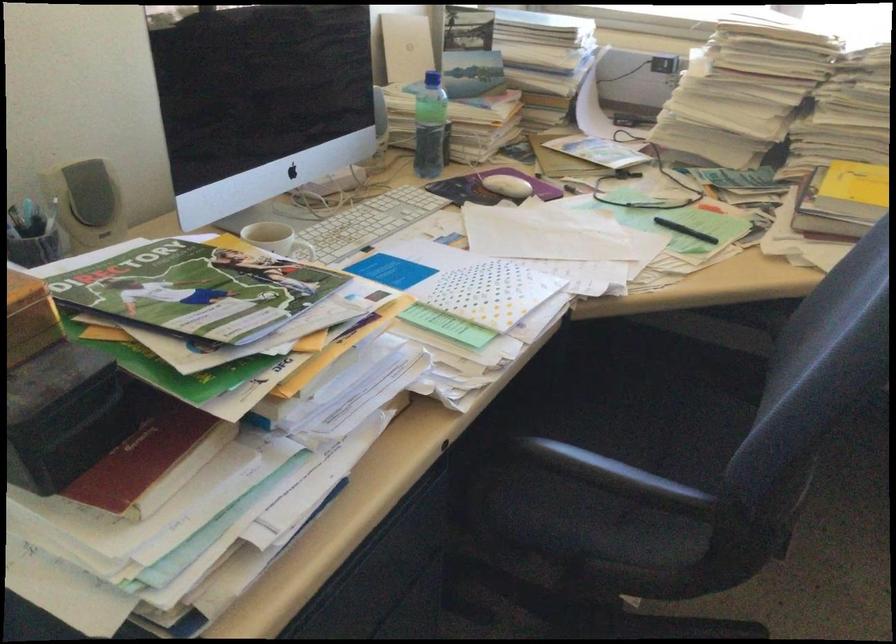
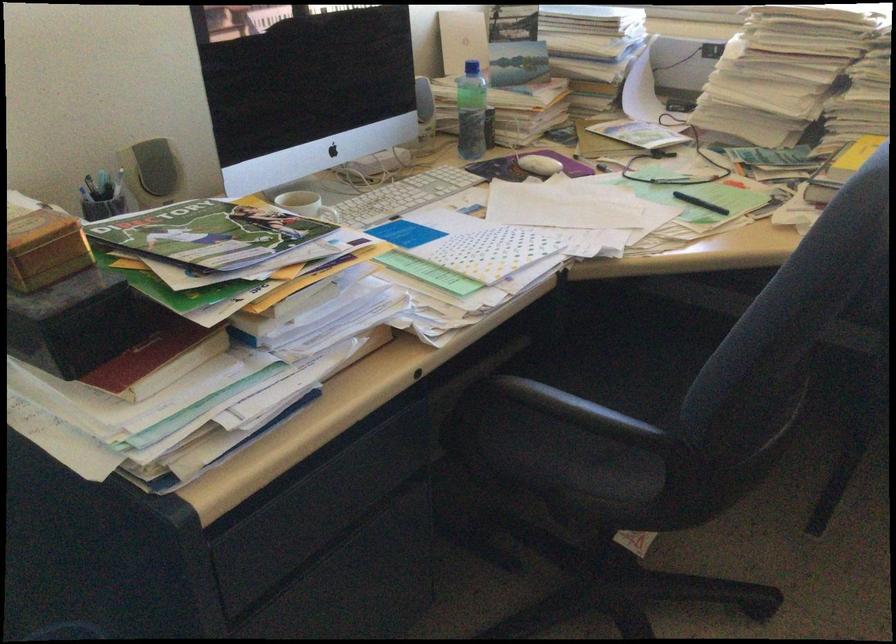
In the second image, find the point that corresponds to the point at 431,127 in the first image.

(470, 111)